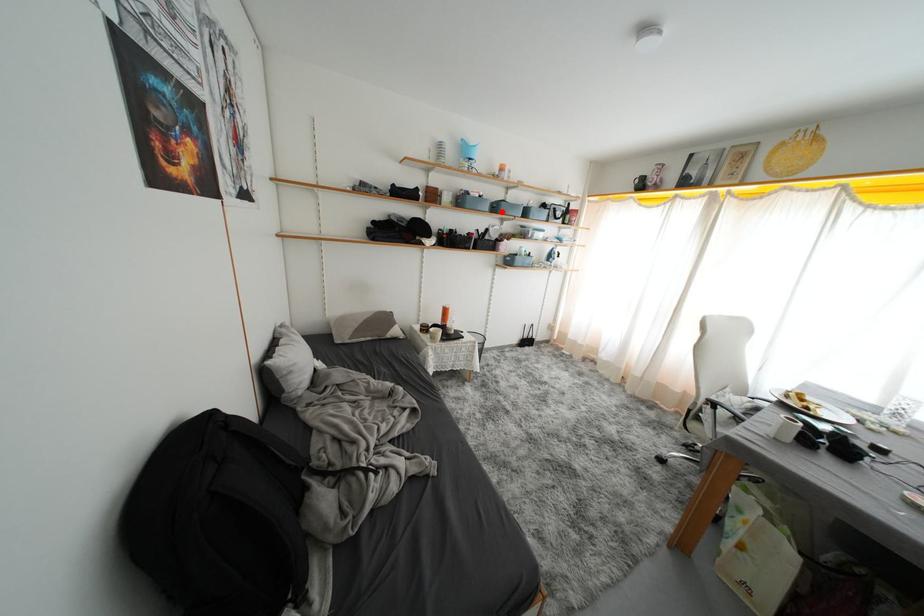
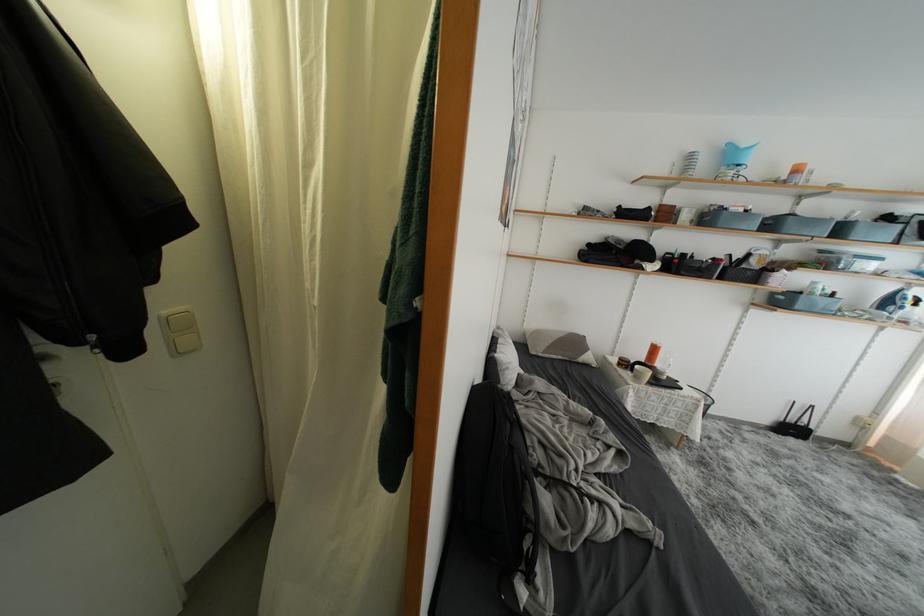
Question: A red point is marked in image1. In image2, is the corresponding 3D point closer to the camera or farther? Reply with the corresponding letter.

Choices:
 (A) The corresponding 3D point is closer.
 (B) The corresponding 3D point is farther.

Answer: (B)